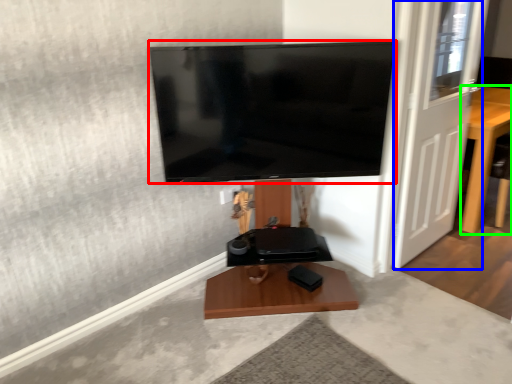
Question: Which object is positioned closest to television (highlighted by a red box)? Select from door (highlighted by a blue box) and furniture (highlighted by a green box).

Choices:
 (A) door
 (B) furniture

Answer: (A)